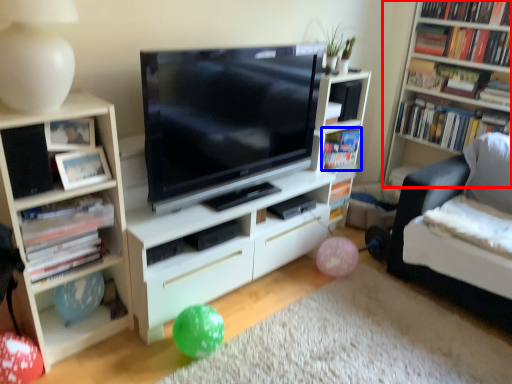
Question: Which point is further to the camera, shelf (highlighted by a red box) or book (highlighted by a blue box)?

Choices:
 (A) shelf
 (B) book

Answer: (B)